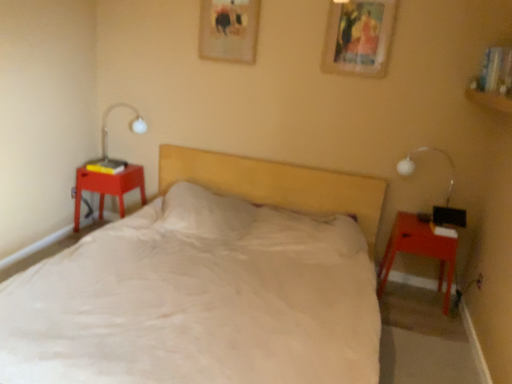
Locate an element on the screen. The height and width of the screenshot is (384, 512). free spot below white glossy table lamp at left (from a real-world perspective) is located at coordinates (128, 165).